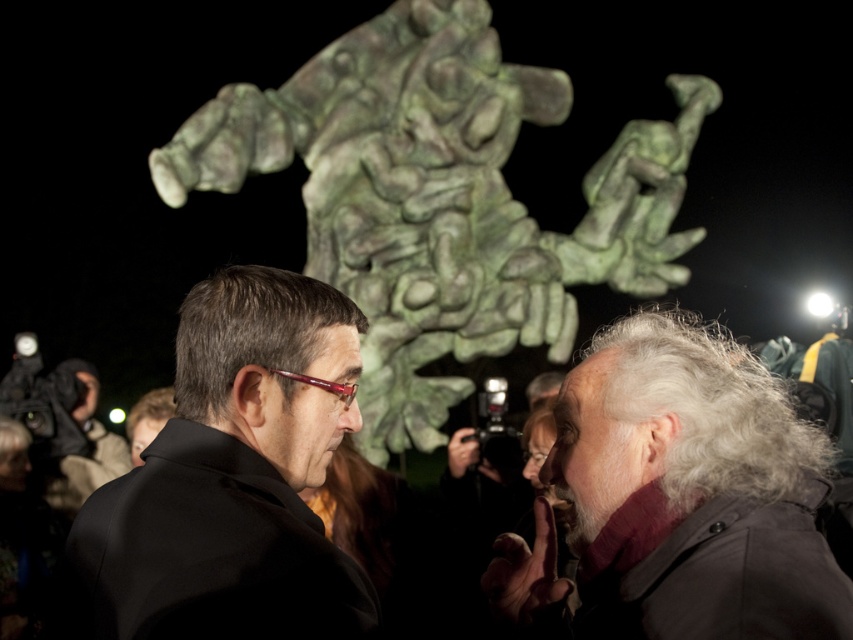
Question: Which object is closer to the camera taking this photo?

Choices:
 (A) gray woolen scarf at lower right
 (B) green patina stone sculpture at upper center

Answer: (A)

Question: Which point is closer to the camera?

Choices:
 (A) (476, 292)
 (B) (782, 566)

Answer: (B)

Question: Is green patina stone sculpture at upper center smaller than black matte suit at center?

Choices:
 (A) yes
 (B) no

Answer: (B)

Question: Is green patina stone sculpture at upper center thinner than gray woolen scarf at lower right?

Choices:
 (A) yes
 (B) no

Answer: (B)

Question: Can you confirm if gray woolen scarf at lower right is positioned to the right of black matte suit at center?

Choices:
 (A) yes
 (B) no

Answer: (A)

Question: Among these points, which one is farthest from the camera?

Choices:
 (A) (115, 477)
 (B) (662, 616)

Answer: (A)